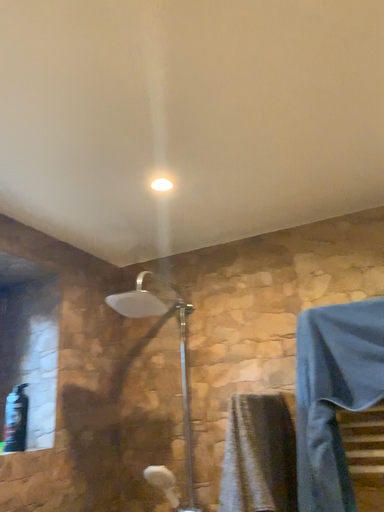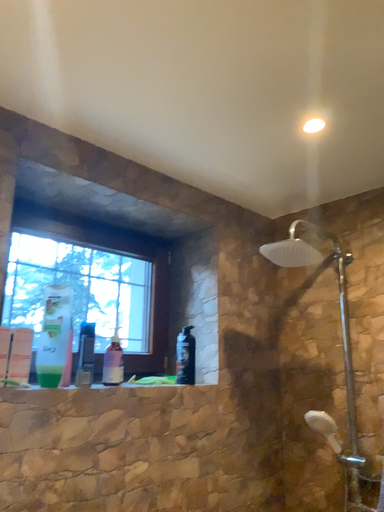
Question: How did the camera likely rotate when shooting the video?

Choices:
 (A) rotated right
 (B) rotated left

Answer: (B)